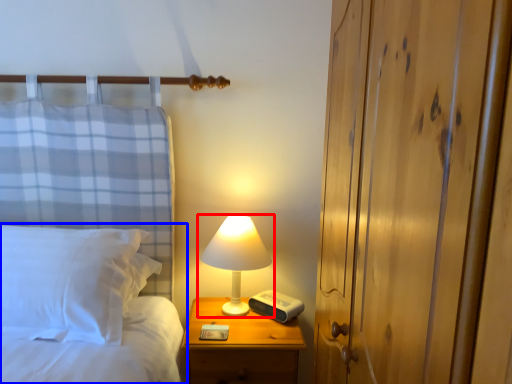
Question: Among these objects, which one is nearest to the camera, lamp (highlighted by a red box) or bed (highlighted by a blue box)?

Choices:
 (A) lamp
 (B) bed

Answer: (B)